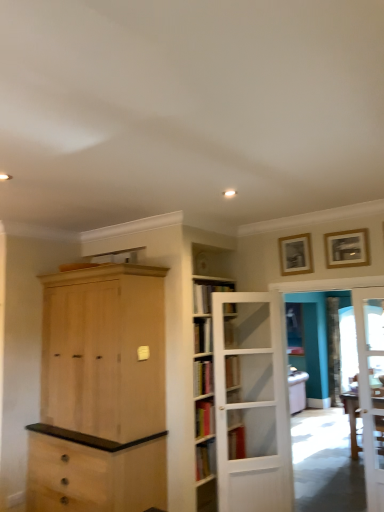
Locate an element on the screen. This screenshot has height=512, width=384. empty space that is ontop of white wooden door at center, the first door when ordered from left to right is located at coordinates (237, 294).